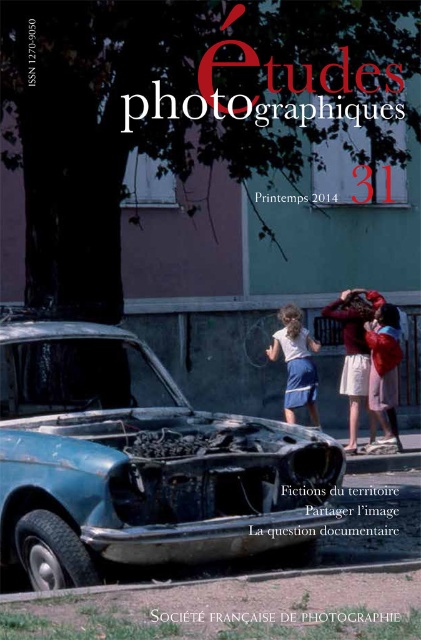
Question: Is pink fabric dress at center closer to the viewer compared to matte white shirt at center?

Choices:
 (A) no
 (B) yes

Answer: (B)

Question: Which point is farther to the camera?

Choices:
 (A) matte red jacket at center
 (B) pink fabric dress at center

Answer: (B)

Question: Estimate the real-world distances between objects in this image. Which object is closer to the blue metallic car at lower left?

Choices:
 (A) matte white shirt at center
 (B) matte red jacket at center

Answer: (B)

Question: Can you confirm if pink fabric dress at center is wider than matte red jacket at center?

Choices:
 (A) no
 (B) yes

Answer: (B)

Question: Does matte red jacket at center appear under matte white shirt at center?

Choices:
 (A) no
 (B) yes

Answer: (B)

Question: Which point is closer to the camera taking this photo?

Choices:
 (A) (391, 442)
 (B) (317, 420)
 (C) (349, 438)
 (D) (236, 512)

Answer: (D)